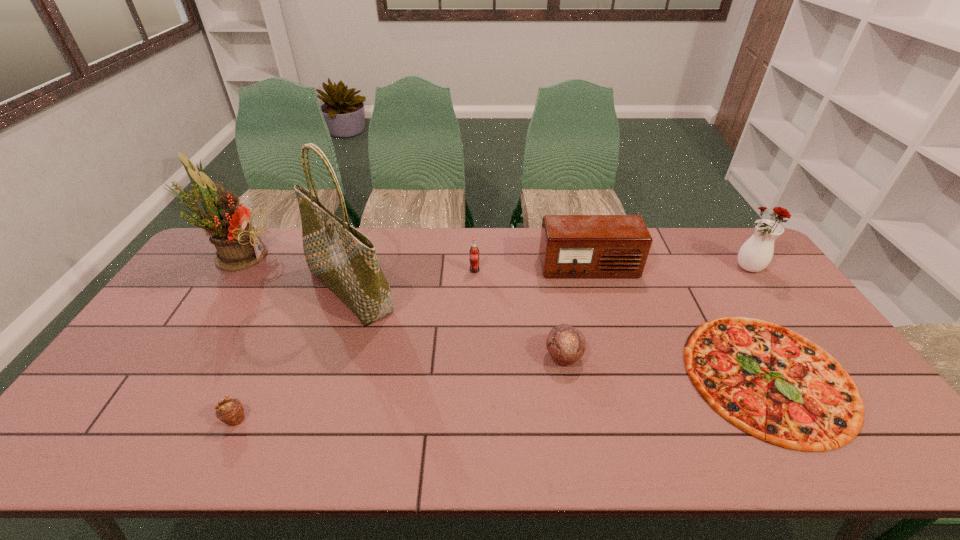
You are a GUI agent. You are given a task and a screenshot of the screen. Output one action in this format:
    pyautogui.click(x=<x>, y=<y>)
    Task: Click on the shopping bag situated at the far edge
    This screenshot has height=540, width=960.
    Given the screenshot: What is the action you would take?
    pyautogui.click(x=344, y=259)

Identify the location of flower arrangement situated at the far edge. Image resolution: width=960 pixels, height=540 pixels. (238, 244).

You are a GUI agent. You are given a task and a screenshot of the screen. Output one action in this format:
    pyautogui.click(x=<x>, y=<y>)
    Task: Click on the vase that is at the far edge
    The height and width of the screenshot is (540, 960).
    Given the screenshot: What is the action you would take?
    pyautogui.click(x=755, y=254)

At what (x,y) coordinates should I click in order to perform the action: click on radio receiver present at the far edge. Please return your answer as a coordinate pair (x, y). Looking at the image, I should click on (571, 246).

Identify the location of soda bottle located in the far edge section of the desktop. This screenshot has height=540, width=960. (474, 251).

The width and height of the screenshot is (960, 540). Find the location of `muffin located at the near edge`. muffin located at the near edge is located at coordinates (230, 411).

Where is `pizza located at the near edge`? This screenshot has width=960, height=540. pizza located at the near edge is located at coordinates (771, 382).

This screenshot has height=540, width=960. I want to click on object located at the left edge, so click(238, 244).

The height and width of the screenshot is (540, 960). In order to click on vase positioned at the right edge in this screenshot , I will do `click(755, 254)`.

The image size is (960, 540). I want to click on pizza that is positioned at the right edge, so click(x=771, y=382).